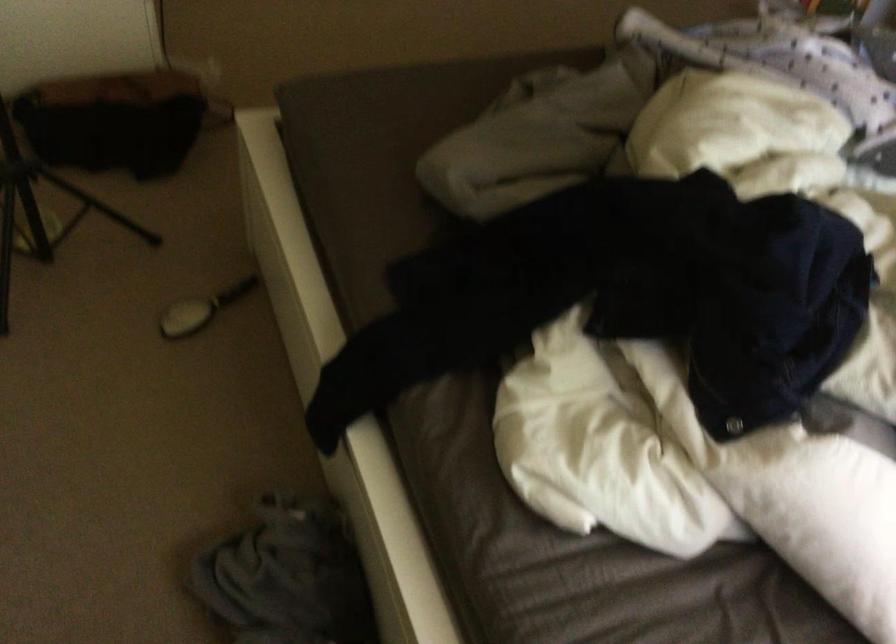
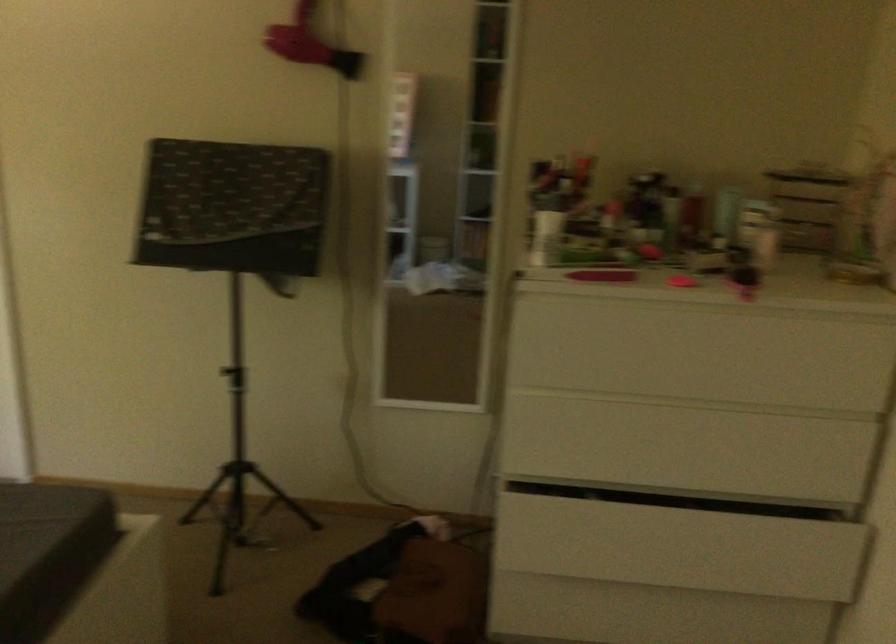
Find the pixel in the second image that matches the point at 393,96 in the first image.

(38, 523)